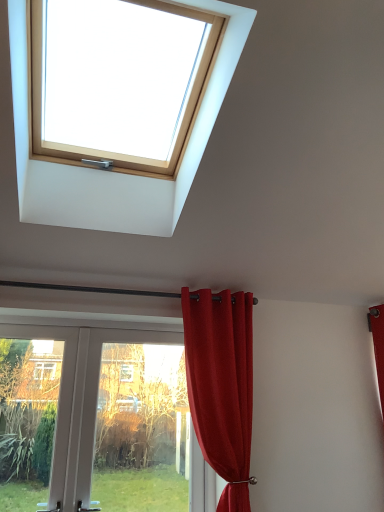
In order to face wooden skylight at upper center, should I rotate leftwards or rightwards?

A 9.932 degree turn to the left will do.

This screenshot has width=384, height=512. What do you see at coordinates (111, 173) in the screenshot?
I see `wooden skylight at upper center` at bounding box center [111, 173].

Describe the element at coordinates (93, 420) in the screenshot. The width and height of the screenshot is (384, 512). I see `white plastic door at lower left` at that location.

At what (x,y) coordinates should I click in order to perform the action: click on wooden skylight at upper center. Please return your answer as a coordinate pair (x, y). The width and height of the screenshot is (384, 512). Looking at the image, I should click on (111, 173).

Is white plastic door at lower left at the back of transparent glass door at lower left?

Yes, transparent glass door at lower left is facing away from white plastic door at lower left.

Between transparent glass door at lower left and white plastic door at lower left, which one has larger size?

white plastic door at lower left.

From a real-world perspective, which object stands above the other?

white plastic door at lower left.

In the scene shown: Which is correct: transparent glass door at lower left is inside white plastic door at lower left, or outside of it?

transparent glass door at lower left is spatially positioned inside white plastic door at lower left.

From the picture: Does white plastic door at lower left turn towards wooden skylight at upper center?

No, white plastic door at lower left does not turn towards wooden skylight at upper center.

From the image's perspective, is white plastic door at lower left on wooden skylight at upper center?

Actually, white plastic door at lower left appears below wooden skylight at upper center in the image.

Does white plastic door at lower left have a lesser width compared to wooden skylight at upper center?

Indeed, white plastic door at lower left has a lesser width compared to wooden skylight at upper center.

Does point (108, 490) lie behind point (220, 2)?

Yes, point (108, 490) is farther from viewer.

Is satin red curtain at upper center at the back of transparent glass door at lower left?

That's not correct — transparent glass door at lower left is not looking away from satin red curtain at upper center.

Is transparent glass door at lower left wider or thinner than satin red curtain at upper center?

transparent glass door at lower left is thinner than satin red curtain at upper center.

Which is in front, transparent glass door at lower left or satin red curtain at upper center?

satin red curtain at upper center is closer to the camera.

Can you tell me how much transparent glass door at lower left and satin red curtain at upper center differ in facing direction?

The angular difference between transparent glass door at lower left and satin red curtain at upper center is 2.66 degrees.

In the image, is transparent glass door at lower left positioned in front of or behind wooden skylight at upper center?

transparent glass door at lower left is positioned farther from the viewer than wooden skylight at upper center.

Which is more to the right, transparent glass door at lower left or wooden skylight at upper center?

transparent glass door at lower left.

Is transparent glass door at lower left next to wooden skylight at upper center?

transparent glass door at lower left and wooden skylight at upper center are clearly separated.

The width and height of the screenshot is (384, 512). What are the coordinates of `window that is above the transparent glass door at lower left (from a real-world perspective)` in the screenshot? It's located at point(111,173).

Is satin red curtain at upper center aimed at transparent glass door at lower left?

No, satin red curtain at upper center is not oriented towards transparent glass door at lower left.

Who is bigger, satin red curtain at upper center or transparent glass door at lower left?

satin red curtain at upper center.

Does satin red curtain at upper center have a greater height compared to transparent glass door at lower left?

Correct, satin red curtain at upper center is much taller as transparent glass door at lower left.

From a real-world perspective, is white plastic door at lower left positioned over transparent glass door at lower left based on gravity?

Yes, from a real-world perspective, white plastic door at lower left is above transparent glass door at lower left.

Between white plastic door at lower left and transparent glass door at lower left, which one appears on the right side from the viewer's perspective?

transparent glass door at lower left is more to the right.

Is white plastic door at lower left taller or shorter than transparent glass door at lower left?

Considering their sizes, white plastic door at lower left has more height than transparent glass door at lower left.

From the image's perspective, is white plastic door at lower left located beneath transparent glass door at lower left?

Actually, white plastic door at lower left appears above transparent glass door at lower left in the image.

Is point (44, 162) positioned after point (245, 338)?

That is False.

Find the location of `curtain on the right of the wooden skylight at upper center`. curtain on the right of the wooden skylight at upper center is located at coordinates (221, 385).

Consider the image. Which of these two, wooden skylight at upper center or satin red curtain at upper center, is wider?

With larger width is wooden skylight at upper center.

Locate an element on the screen. glass door on the right side of white plastic door at lower left is located at coordinates (142, 429).

You are a GUI agent. You are given a task and a screenshot of the screen. Output one action in this format:
    pyautogui.click(x=<x>, y=<y>)
    Task: Click on the door below the wooden skylight at upper center (from a real-world perspective)
    
    Given the screenshot: What is the action you would take?
    pyautogui.click(x=93, y=420)

Consider the image. From the image, which object appears to be farther from white plastic door at lower left, transparent glass door at lower left or satin red curtain at upper center?

satin red curtain at upper center lies further to white plastic door at lower left than the other object.

Based on their spatial positions, is transparent glass door at lower left or wooden skylight at upper center further from white plastic door at lower left?

The object further to white plastic door at lower left is wooden skylight at upper center.

From the image, which object appears to be farther from satin red curtain at upper center, white plastic door at lower left or wooden skylight at upper center?

The object further to satin red curtain at upper center is white plastic door at lower left.

When comparing their distances from wooden skylight at upper center, does satin red curtain at upper center or transparent glass door at lower left seem further?

Among the two, transparent glass door at lower left is located further to wooden skylight at upper center.

Looking at the image, which one is located further to transparent glass door at lower left, satin red curtain at upper center or wooden skylight at upper center?

wooden skylight at upper center is further to transparent glass door at lower left.

From the image, which object appears to be nearer to white plastic door at lower left, wooden skylight at upper center or satin red curtain at upper center?

satin red curtain at upper center is positioned closer to the anchor white plastic door at lower left.

Looking at this image, from the image, which object appears to be farther from white plastic door at lower left, satin red curtain at upper center or wooden skylight at upper center?

Among the two, wooden skylight at upper center is located further to white plastic door at lower left.

Looking at this image, from the image, which object appears to be nearer to wooden skylight at upper center, white plastic door at lower left or transparent glass door at lower left?

white plastic door at lower left.

At what (x,y) coordinates should I click in order to perform the action: click on curtain between wooden skylight at upper center and white plastic door at lower left in the up-down direction. Please return your answer as a coordinate pair (x, y). The width and height of the screenshot is (384, 512). Looking at the image, I should click on (221, 385).

At what (x,y) coordinates should I click in order to perform the action: click on door between wooden skylight at upper center and transparent glass door at lower left in the vertical direction. Please return your answer as a coordinate pair (x, y). Looking at the image, I should click on (93, 420).

Find the location of a particular element. This screenshot has height=512, width=384. glass door between white plastic door at lower left and satin red curtain at upper center from left to right is located at coordinates (142, 429).

I want to click on curtain between wooden skylight at upper center and transparent glass door at lower left in the up-down direction, so click(x=221, y=385).